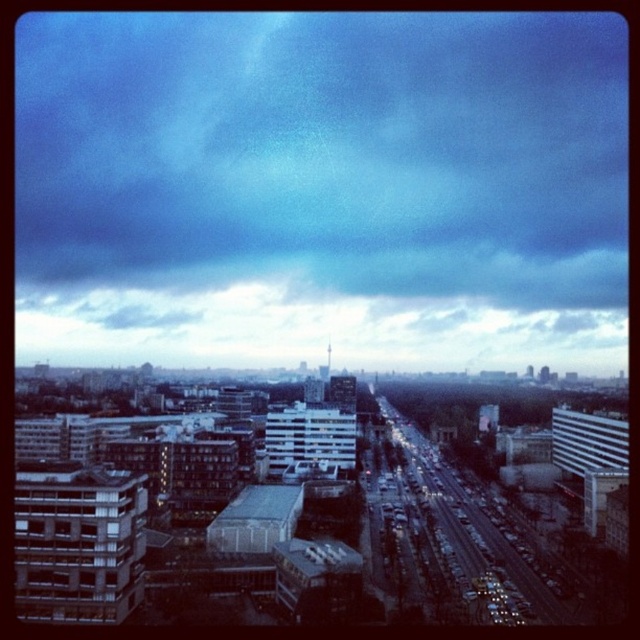
Can you confirm if dark blue cloud at upper center is positioned below cloudy sky at center?

No, dark blue cloud at upper center is not below cloudy sky at center.

Which is more to the right, dark blue cloud at upper center or cloudy sky at center?

cloudy sky at center

Does point (538, 202) come farther from viewer compared to point (246, 307)?

Yes, point (538, 202) is farther from viewer.

Locate an element on the screen. The image size is (640, 640). dark blue cloud at upper center is located at coordinates (321, 188).